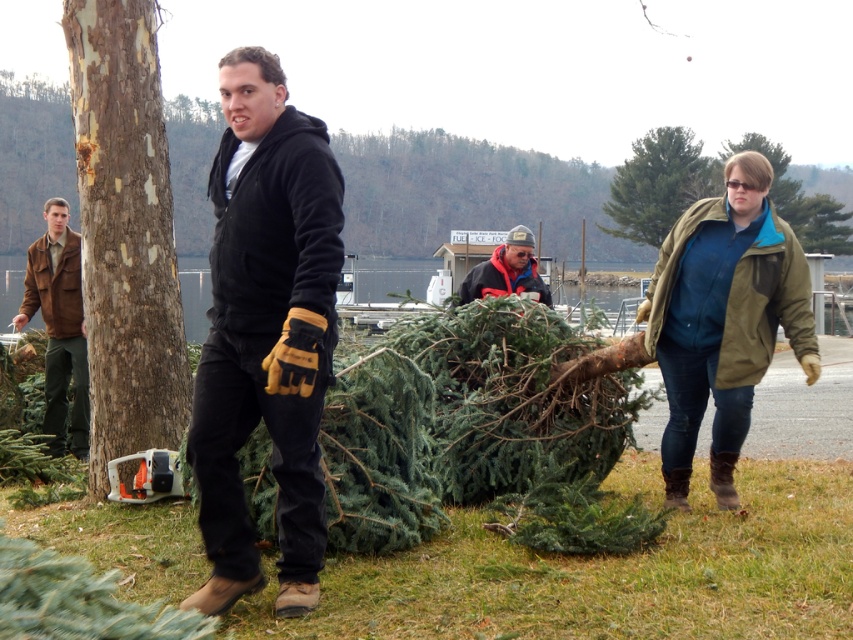
You are standing at the point labeled point (294, 128) and want to walk to the point labeled point (637, 241). Which direction should you move in relation to the camera?

You should move away from the camera because point (637, 241) is farther from the viewer than point (294, 128).